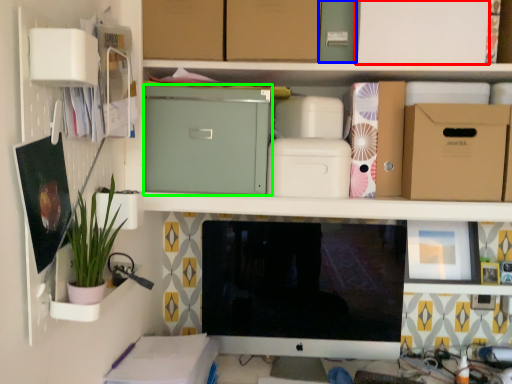
Question: Which object is positioned farthest from cardboard box (highlighted by a red box)? Select from storage box (highlighted by a blue box) and cardboard box (highlighted by a green box).

Choices:
 (A) storage box
 (B) cardboard box

Answer: (B)